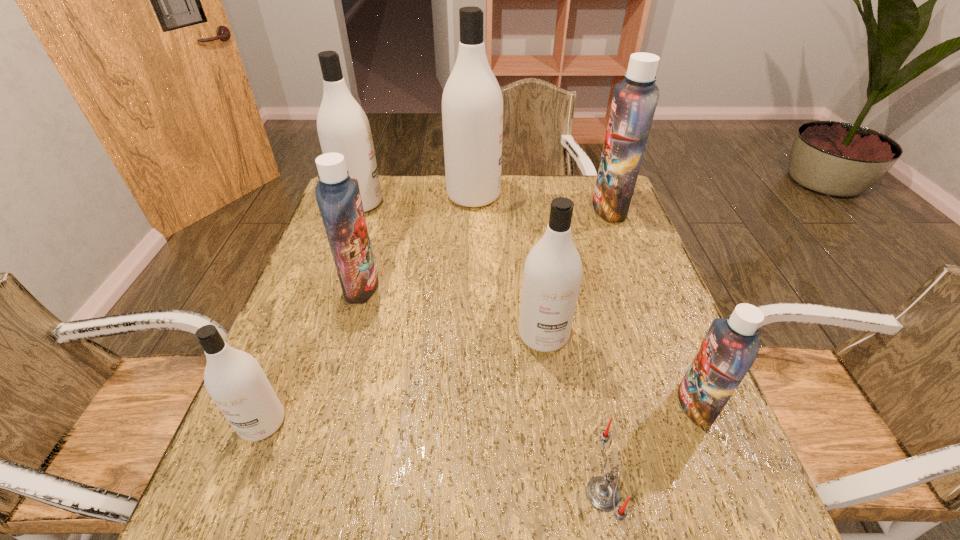
Locate an element on the screen. Image resolution: width=960 pixels, height=540 pixels. the seventh closest object to the biggest blue shampoo is located at coordinates (234, 379).

Locate an element on the screen. object that can be found as the second closest to the nearest blue shampoo is located at coordinates (552, 274).

Select which shampoo is the fourth closest to the second farthest blue shampoo. Please provide its 2D coordinates. Your answer should be formatted as a tuple, i.e. [(x, y)], where the tuple contains the x and y coordinates of a point satisfying the conditions above.

[(552, 274)]

You are a GUI agent. You are given a task and a screenshot of the screen. Output one action in this format:
    pyautogui.click(x=<x>, y=<y>)
    Task: Click on the second closest shampoo to the leftmost blue shampoo
    Image resolution: width=960 pixels, height=540 pixels.
    Given the screenshot: What is the action you would take?
    pyautogui.click(x=234, y=379)

In order to click on white shampoo that stands as the second closest to the smallest blue shampoo in this screenshot , I will do `click(472, 102)`.

Choose which white shampoo is the third nearest neighbor to the smallest blue shampoo. Please provide its 2D coordinates. Your answer should be formatted as a tuple, i.e. [(x, y)], where the tuple contains the x and y coordinates of a point satisfying the conditions above.

[(234, 379)]

Where is `blue shampoo that stands as the third closest to the third shampoo from right to left`? blue shampoo that stands as the third closest to the third shampoo from right to left is located at coordinates (634, 102).

Select which blue shampoo is the closest to the nearest blue shampoo. Please provide its 2D coordinates. Your answer should be formatted as a tuple, i.e. [(x, y)], where the tuple contains the x and y coordinates of a point satisfying the conditions above.

[(634, 102)]

Locate an element on the screen. The width and height of the screenshot is (960, 540). vacant area that satisfies the following two spatial constraints: 1. on the front-facing side of the third smallest white shampoo; 2. on the front-facing side of the nearest white shampoo is located at coordinates pos(282,423).

At what (x,y) coordinates should I click in order to perform the action: click on free space that satisfies the following two spatial constraints: 1. on the front label of the nearest blue shampoo; 2. on the front-facing side of the smallest white shampoo. Please return your answer as a coordinate pair (x, y). Image resolution: width=960 pixels, height=540 pixels. Looking at the image, I should click on (703, 423).